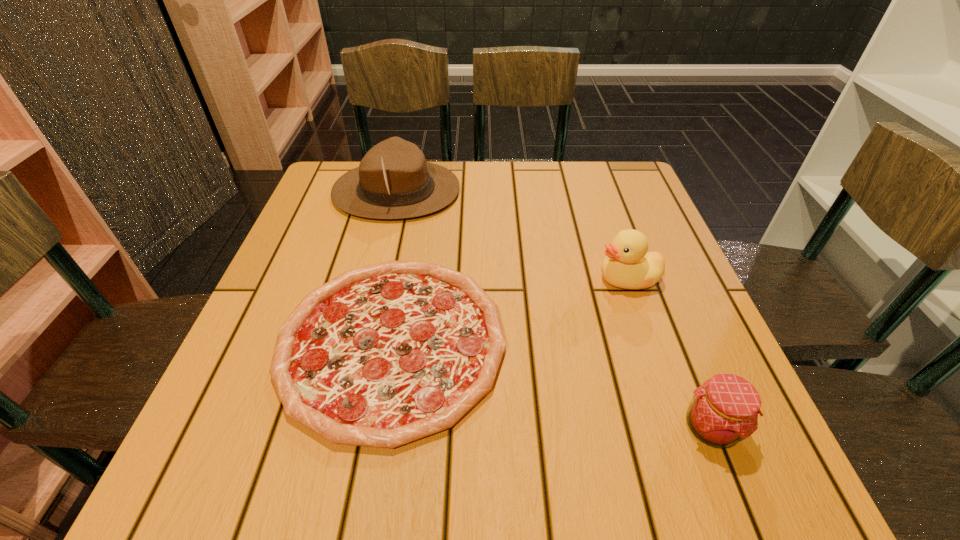
This screenshot has width=960, height=540. In order to click on object positioned at the near right corner in this screenshot , I will do `click(724, 410)`.

The width and height of the screenshot is (960, 540). What are the coordinates of `vacant space at the far edge of the desktop` in the screenshot? It's located at (584, 209).

The image size is (960, 540). I want to click on vacant area at the near edge of the desktop, so click(585, 448).

At what (x,y) coordinates should I click in order to perform the action: click on blank space at the right edge. Please return your answer as a coordinate pair (x, y). The width and height of the screenshot is (960, 540). Looking at the image, I should click on (671, 370).

Where is `vacant space at the near left corner of the desktop`? The height and width of the screenshot is (540, 960). vacant space at the near left corner of the desktop is located at coordinates (246, 492).

Identify the location of vacant region at the far right corner of the desktop. (589, 178).

Find the location of `free space between the second tallest object and the fedora`. free space between the second tallest object and the fedora is located at coordinates (512, 235).

Locate an element on the screen. This screenshot has width=960, height=540. free space between the pizza and the third shortest object is located at coordinates (510, 310).

This screenshot has width=960, height=540. In order to click on free point between the jam and the third shortest object in this screenshot , I will do `click(669, 353)`.

Find the location of a particular element. This screenshot has height=540, width=960. empty space that is in between the tallest object and the duck is located at coordinates (512, 235).